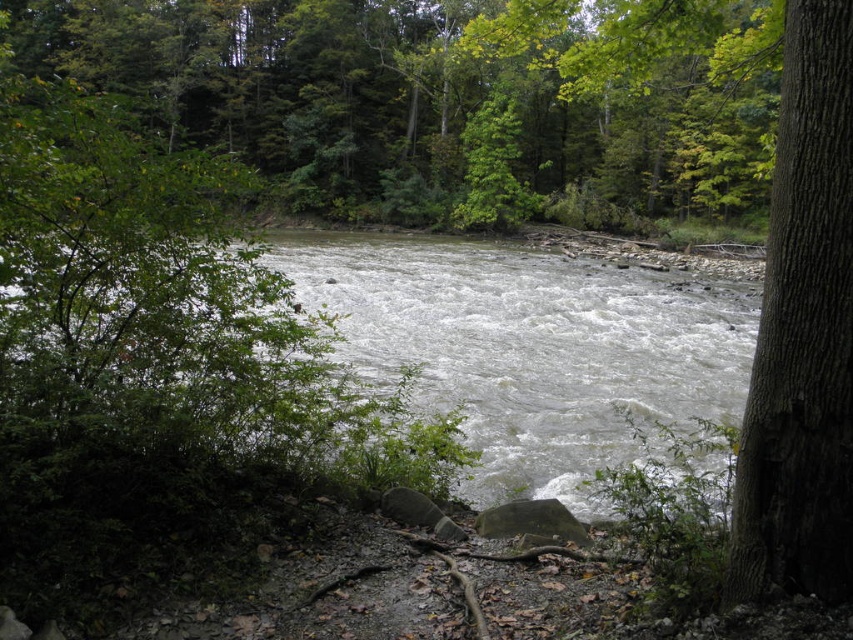
From the picture: You are a hiker standing at the riverbank and want to take a photo of both the green leafy tree at center and the white frothy water at center. Which object should you focus on first to ensure both are in frame?

The green leafy tree at center is taller than the white frothy water at center, so you should focus on the green leafy tree at center first to ensure both are in frame.

You are a hiker standing at the riverbank and want to take a photo of both the green leafy tree at center and the smooth brown tree trunk at right. Which object should you focus on first to ensure both are in the frame?

You should focus on the green leafy tree at center first because it is closer to you than the smooth brown tree trunk at right, so adjusting the camera to include both would require framing starting from the closer object.

You are a hiker who wants to cross the river using the green leafy tree at center and the white frothy water at center. Can you safely step from the tree onto the water?

The green leafy tree at center is positioned over white frothy water at center, but since water is not solid ground, you cannot safely step from the tree onto the water.